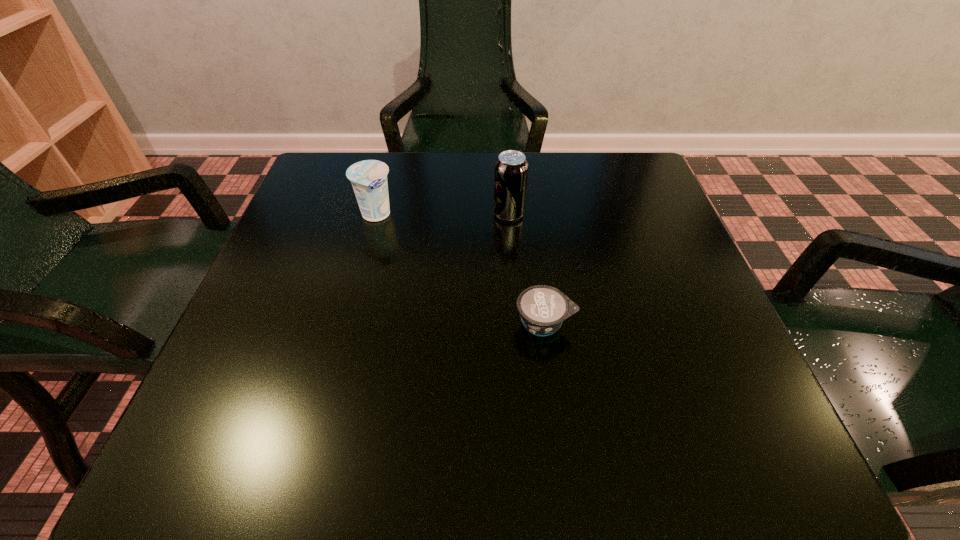
The width and height of the screenshot is (960, 540). Identify the location of free spot that satisfies the following two spatial constraints: 1. on the front side of the shorter yogurt; 2. on the right side of the tallest object. (516, 323).